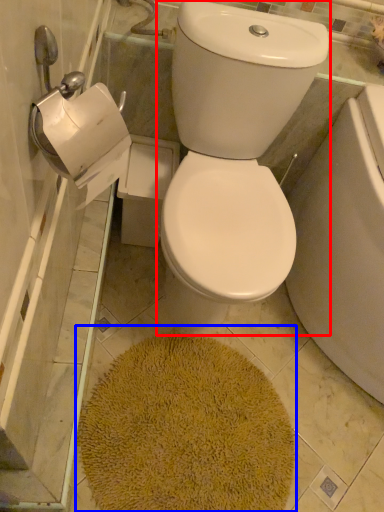
Question: Among these objects, which one is nearest to the camera, toilet bowl (highlighted by a red box) or bath mat (highlighted by a blue box)?

Choices:
 (A) toilet bowl
 (B) bath mat

Answer: (A)